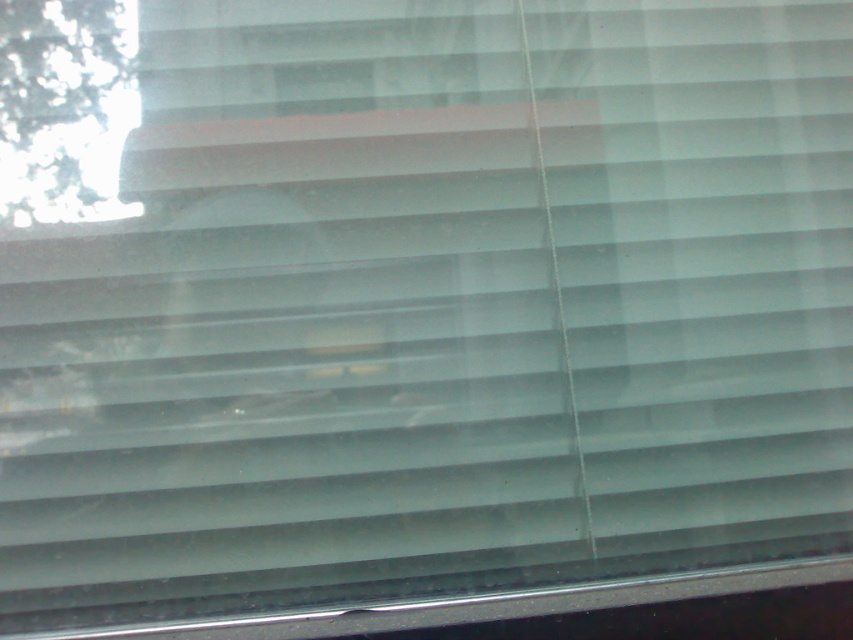
Question: Is green leafy tree at upper left to the right of metallic silver window sill at lower center from the viewer's perspective?

Choices:
 (A) yes
 (B) no

Answer: (B)

Question: Among these objects, which one is farthest from the camera?

Choices:
 (A) metallic silver window sill at lower center
 (B) green leafy tree at upper left

Answer: (B)

Question: Does green leafy tree at upper left have a greater width compared to metallic silver window sill at lower center?

Choices:
 (A) no
 (B) yes

Answer: (A)

Question: Is the position of green leafy tree at upper left more distant than that of metallic silver window sill at lower center?

Choices:
 (A) no
 (B) yes

Answer: (B)